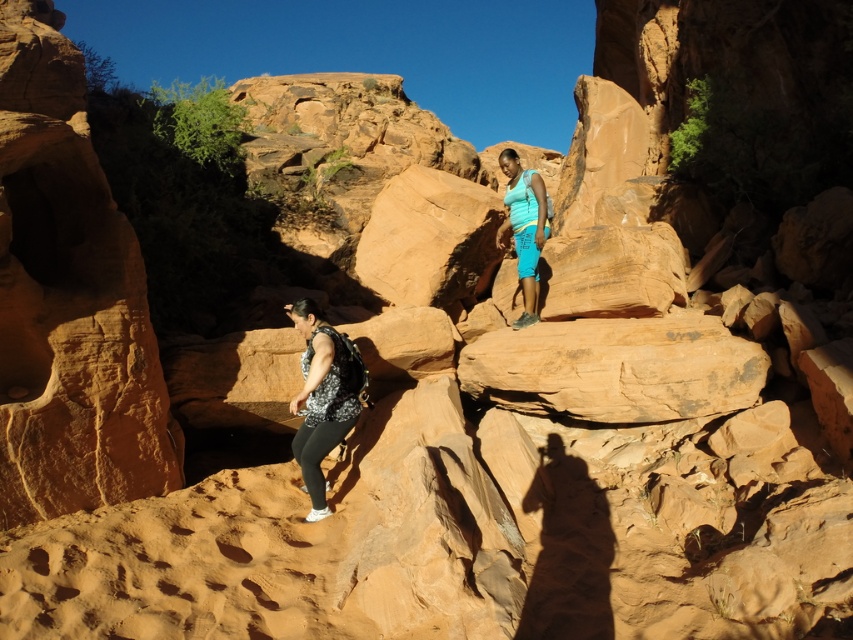
This screenshot has width=853, height=640. Find the location of `floral-patterned fabric at center`. floral-patterned fabric at center is located at coordinates (320, 400).

Who is taller, floral-patterned fabric at center or blue fabric shorts at center?

blue fabric shorts at center is taller.

Who is more forward, (296,433) or (514,182)?

Positioned in front is point (296,433).

Find the location of a particular element. The image size is (853, 640). floral-patterned fabric at center is located at coordinates (320, 400).